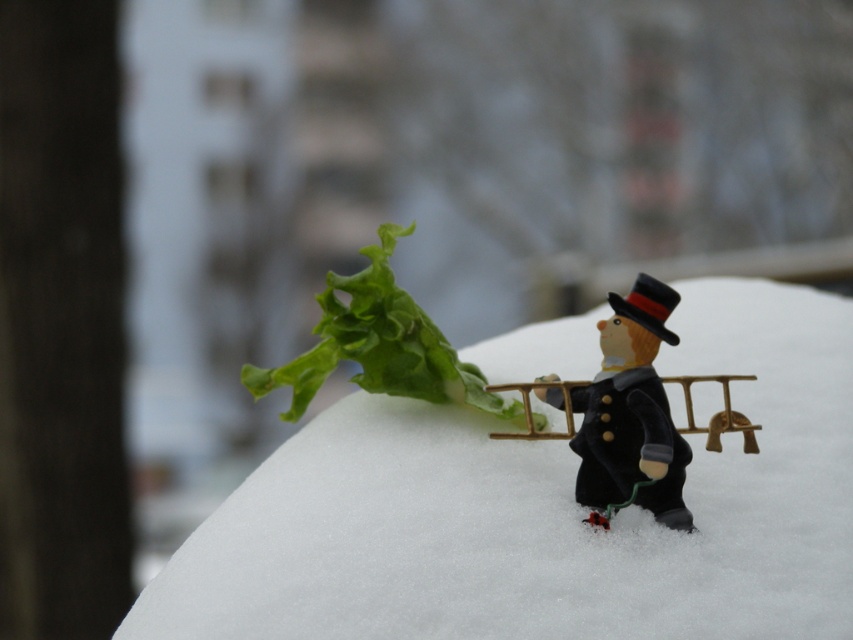
You are a small robot with a width of 3 inches. You want to move from the white fluffy snow at center to the velvet black toy at center. Can you fit through the space between them?

The white fluffy snow at center and velvet black toy at center are 4.43 inches apart from each other. Since your width is 3 inches, you can fit through the space between them as 4.43 inches is greater than 3 inches.

You are a small robot with a height of 10 cm. You are standing on the white fluffy snow at center and want to reach the velvet black toy at center. Can you reach it without moving from your current position?

The white fluffy snow at center is closer to the viewer than velvet black toy at center, so the velvet black toy at center is further away. Since the robot is only 10 cm tall, it may not be able to reach the velvet black toy at center unless it can extend its arm or use another object to bridge the distance.

You are a small animal trying to cross the snow. You see the white fluffy snow at center and the velvet black toy at center. Which one is larger in size?

The white fluffy snow at center is bigger than the velvet black toy at center.